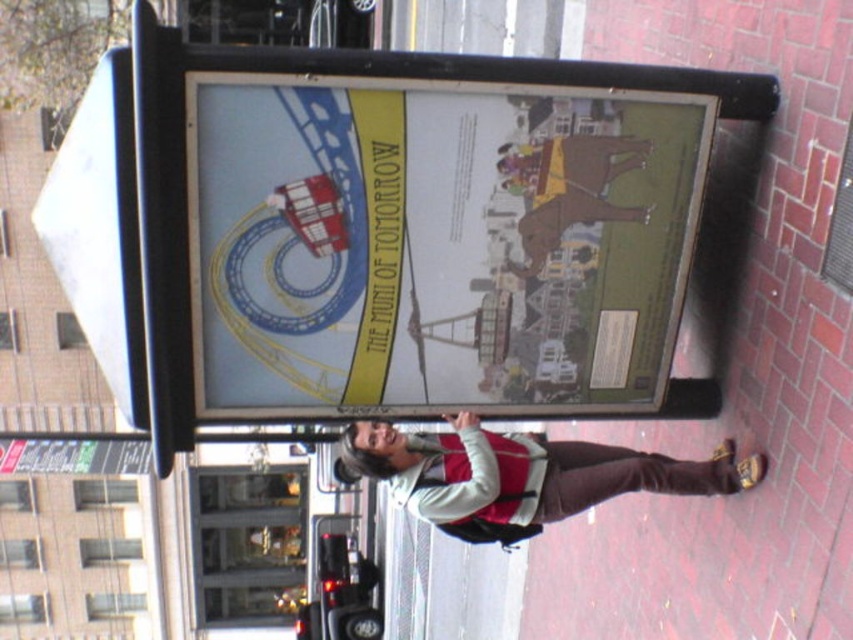
Which is more to the right, matte paper poster at center or velvet-like brown pants at lower right?

From the viewer's perspective, velvet-like brown pants at lower right appears more on the right side.

Between matte paper poster at center and velvet-like brown pants at lower right, which one is positioned lower?

velvet-like brown pants at lower right is lower down.

Where is `matte paper poster at center`? This screenshot has height=640, width=853. matte paper poster at center is located at coordinates (437, 244).